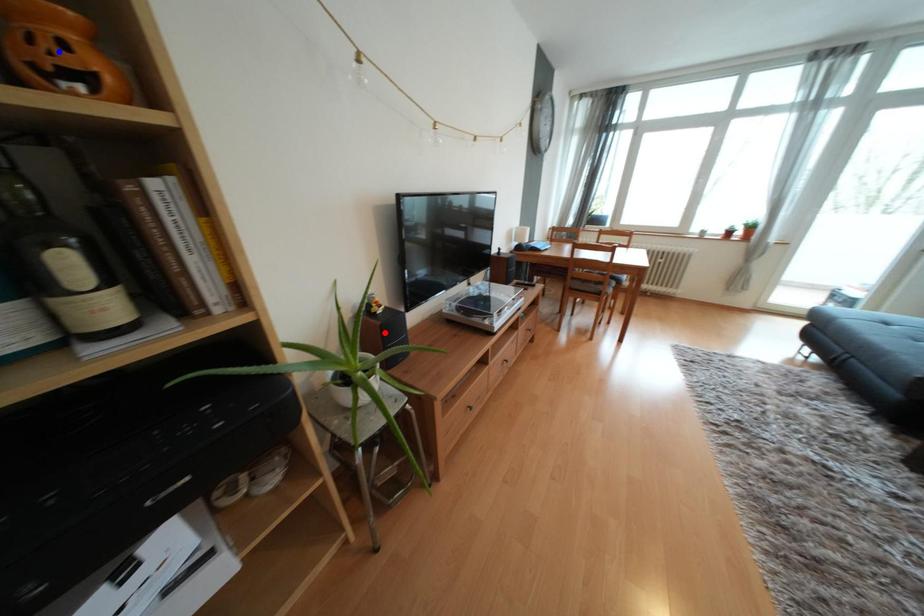
Question: Two points are marked on the image. Which point is closer to the camera?

Choices:
 (A) Blue point is closer.
 (B) Red point is closer.

Answer: (A)